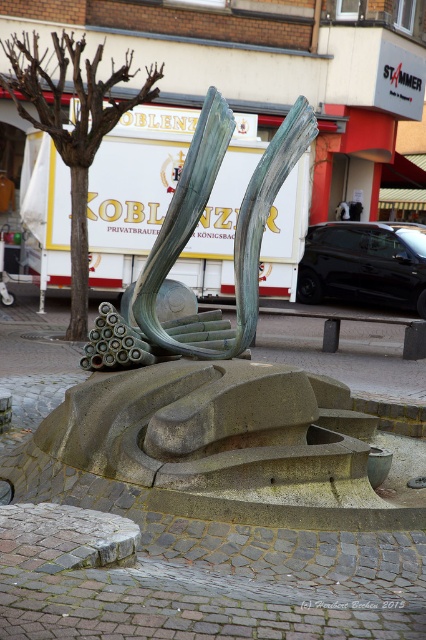
Question: Does bronze sculpture at center appear under brown/dry wood tree at upper left?

Choices:
 (A) no
 (B) yes

Answer: (B)

Question: Is bronze sculpture at center thinner than brown/dry wood tree at upper left?

Choices:
 (A) yes
 (B) no

Answer: (A)

Question: Which point appears closest to the camera in this image?

Choices:
 (A) (154, 76)
 (B) (241, 216)

Answer: (B)

Question: Which point is farther from the camera taking this photo?

Choices:
 (A) (75, 408)
 (B) (245, 262)

Answer: (B)

Question: Can you confirm if bronze sculpture at center is positioned below brown/dry wood tree at upper left?

Choices:
 (A) no
 (B) yes

Answer: (B)

Question: Which point is closer to the camera?

Choices:
 (A) green patina sculpture at center
 (B) bronze sculpture at center
 (C) brown/dry wood tree at upper left

Answer: (B)